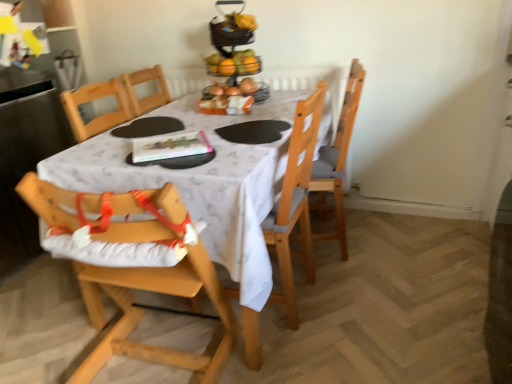
Where is `unoccupied area in front of wooden chair at right, which appears as the 1th chair when viewed from the right`? The width and height of the screenshot is (512, 384). unoccupied area in front of wooden chair at right, which appears as the 1th chair when viewed from the right is located at coordinates (358, 278).